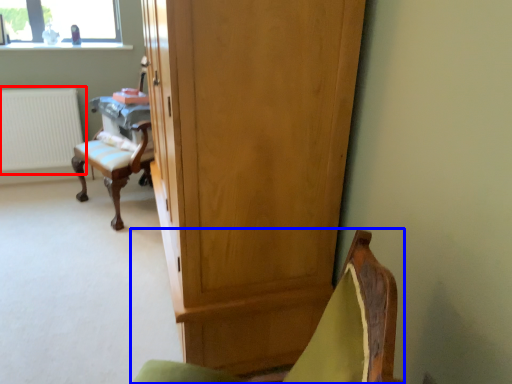
Question: Among these objects, which one is nearest to the camera, radiator (highlighted by a red box) or chair (highlighted by a blue box)?

Choices:
 (A) radiator
 (B) chair

Answer: (B)